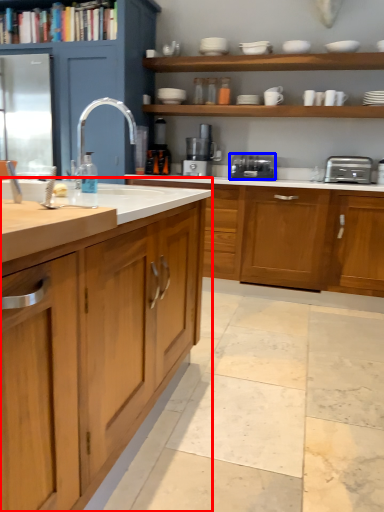
Question: Which of the following is the closest to the observer, countertop (highlighted by a red box) or toaster (highlighted by a blue box)?

Choices:
 (A) countertop
 (B) toaster

Answer: (A)